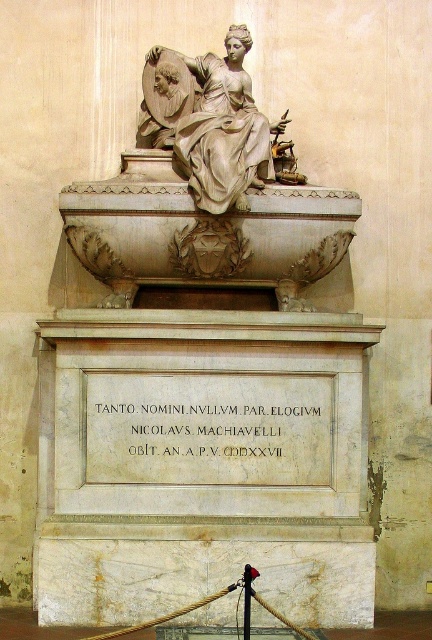
Question: Among these objects, which one is nearest to the camera?

Choices:
 (A) polished marble statue at upper center
 (B) white marble statue at center

Answer: (A)

Question: Does white marble statue at center come behind black stone inscription at center?

Choices:
 (A) yes
 (B) no

Answer: (B)

Question: Which object is positioned farthest from the black stone inscription at center?

Choices:
 (A) polished marble statue at upper center
 (B) white marble statue at center

Answer: (A)

Question: From the image, what is the correct spatial relationship of black stone inscription at center in relation to polished marble statue at upper center?

Choices:
 (A) right
 (B) left

Answer: (A)

Question: In this image, where is black stone inscription at center located relative to polished marble statue at upper center?

Choices:
 (A) below
 (B) above

Answer: (A)

Question: Which point appears farthest from the camera in this image?

Choices:
 (A) (209, 416)
 (B) (190, 132)

Answer: (B)